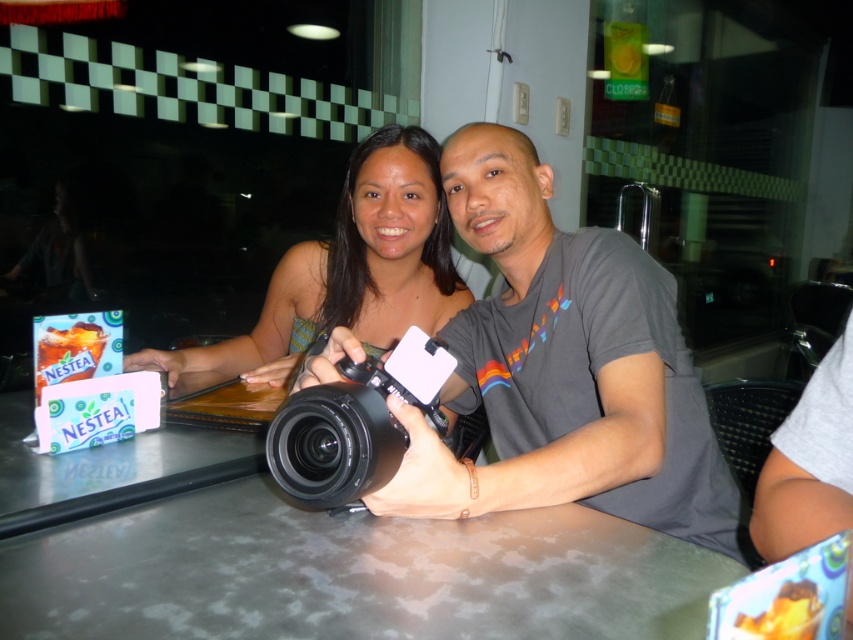
You are trying to decide which camera to use for a photography session that requires a wider lens. Based on the description of the black matte camera at center and the matte black camera at center, which one would you choose?

The black matte camera at center might be wider than the matte black camera at center, so you should choose the black matte camera at center for the photography session that requires a wider lens.

You are a photographer trying to place a new camera on the table in the image. The existing black matte camera at center is already at point 0.578, 0.662. If you want to place your new camera 0.2 units to the right and 0.1 units above the existing one, what would be the new coordinates?

The new coordinates would be calculated by adding 0.2 to the x coordinate and 0.1 to the y coordinate of the black matte camera at center. The original coordinates are (564,369). Adding 0.2 to 0.578 gives 0.778, and adding 0.1 to 0.662 gives 0.762. Therefore, the new coordinates would be (648,497).